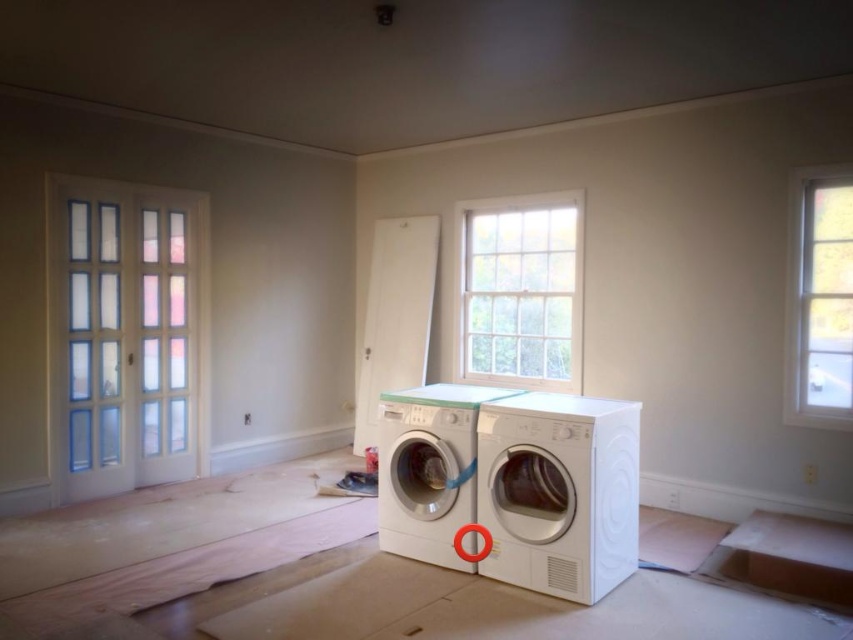
Who is shorter, white glossy washer at center or white wooden window at upper center?

With less height is white glossy washer at center.

Which is in front, point (608, 566) or point (509, 355)?

Point (608, 566) is more forward.

You are a GUI agent. You are given a task and a screenshot of the screen. Output one action in this format:
    pyautogui.click(x=<x>, y=<y>)
    Task: Click on the white glossy washer at center
    The image size is (853, 640).
    Given the screenshot: What is the action you would take?
    pyautogui.click(x=560, y=492)

Locate an element on the screen. This screenshot has height=640, width=853. white glossy washer at center is located at coordinates (560, 492).

Can you confirm if white wooden window at upper center is taller than white glossy washing machine at center?

Correct, white wooden window at upper center is much taller as white glossy washing machine at center.

Is point (503, 225) more distant than point (426, 522)?

Yes, point (503, 225) is behind point (426, 522).

This screenshot has height=640, width=853. I want to click on white wooden window at upper center, so click(520, 291).

This screenshot has height=640, width=853. What do you see at coordinates (560, 492) in the screenshot?
I see `white glossy washer at center` at bounding box center [560, 492].

This screenshot has height=640, width=853. I want to click on white glossy washer at center, so click(560, 492).